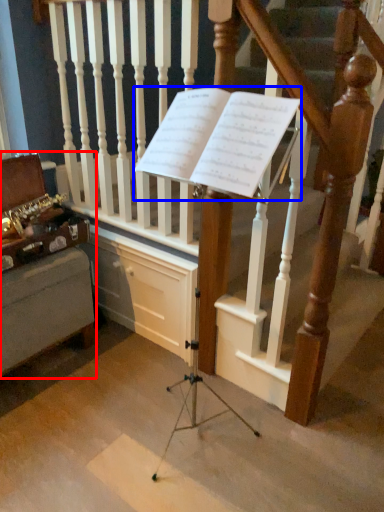
Question: Which point is closer to the camera, furniture (highlighted by a red box) or sheet music (highlighted by a blue box)?

Choices:
 (A) furniture
 (B) sheet music

Answer: (B)